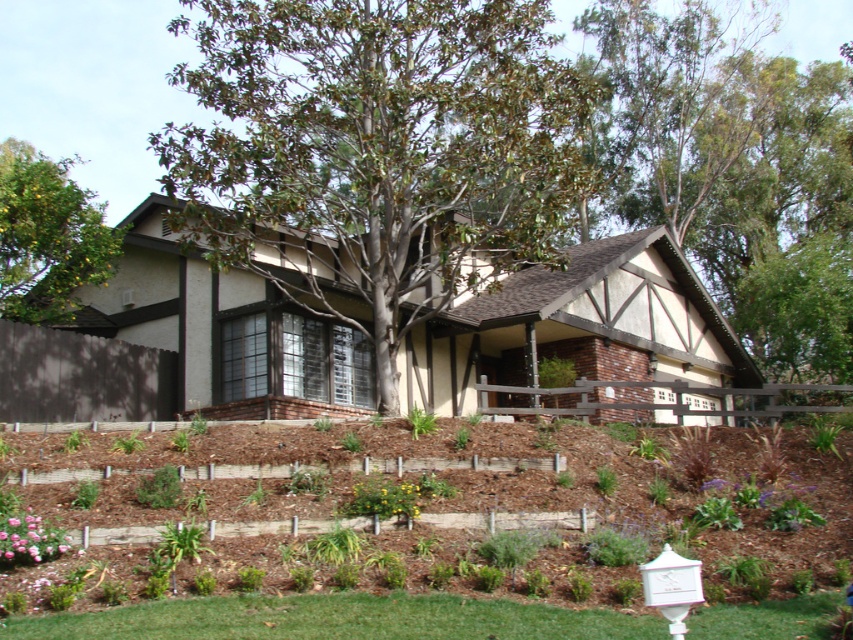
Question: Does mulched soil at lower center appear on the left side of pink matte flower at lower left?

Choices:
 (A) yes
 (B) no

Answer: (B)

Question: Does green leafy tree at center have a greater width compared to mulched soil at lower center?

Choices:
 (A) yes
 (B) no

Answer: (A)

Question: Estimate the real-world distances between objects in this image. Which object is farther from the green leafy tree at upper left?

Choices:
 (A) mulched soil at lower center
 (B) green grass at lower center
 (C) green leafy tree at center

Answer: (B)

Question: Among these objects, which one is nearest to the camera?

Choices:
 (A) green leafy tree at upper center
 (B) green leafy tree at center
 (C) yellow matte flower at lower center
 (D) green leafy tree at upper left

Answer: (C)

Question: Which object is the farthest from the yellow matte flower at lower center?

Choices:
 (A) pink matte flower at lower left
 (B) green leafy tree at upper left
 (C) green leafy tree at center
 (D) green leafy tree at upper center

Answer: (D)

Question: Is green leafy tree at upper center above pink matte flower at lower left?

Choices:
 (A) yes
 (B) no

Answer: (A)